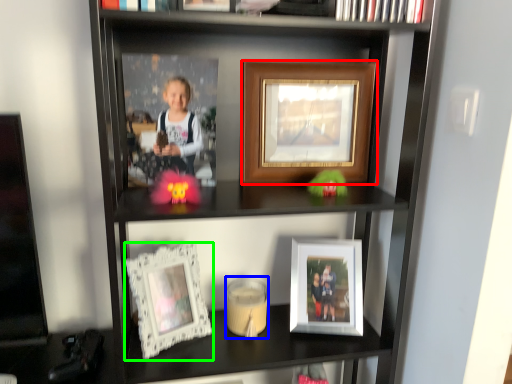
Question: Based on their relative distances, which object is nearer to picture frame (highlighted by a red box)? Choose from candle holder (highlighted by a blue box) and picture frame (highlighted by a green box).

Choices:
 (A) candle holder
 (B) picture frame

Answer: (B)